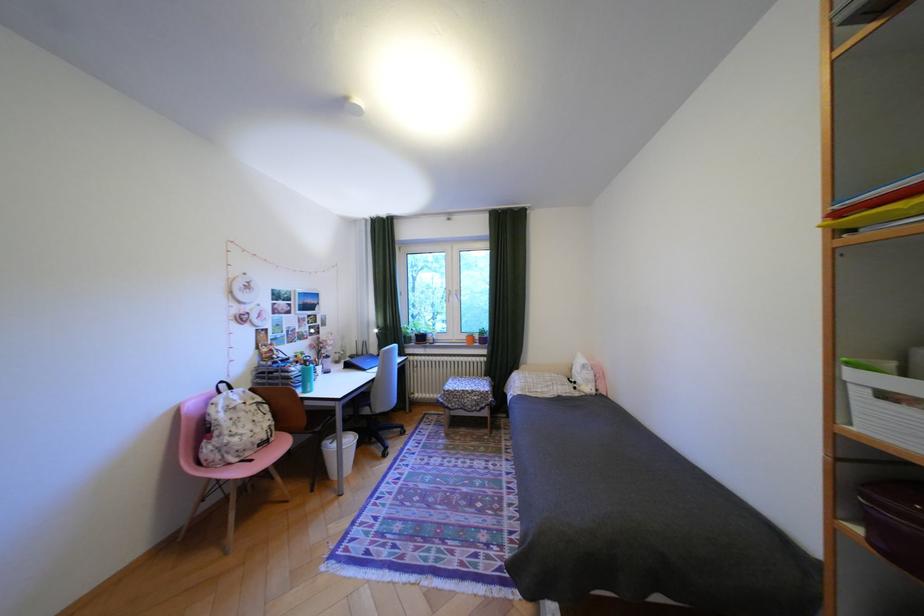
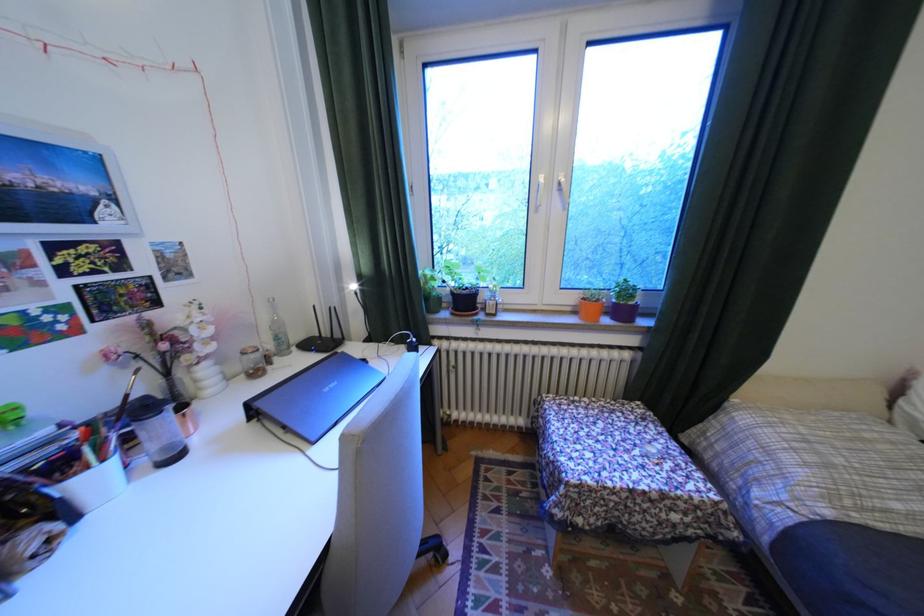
Find the pixel in the second image that matches (421,338) in the first image.

(451, 299)